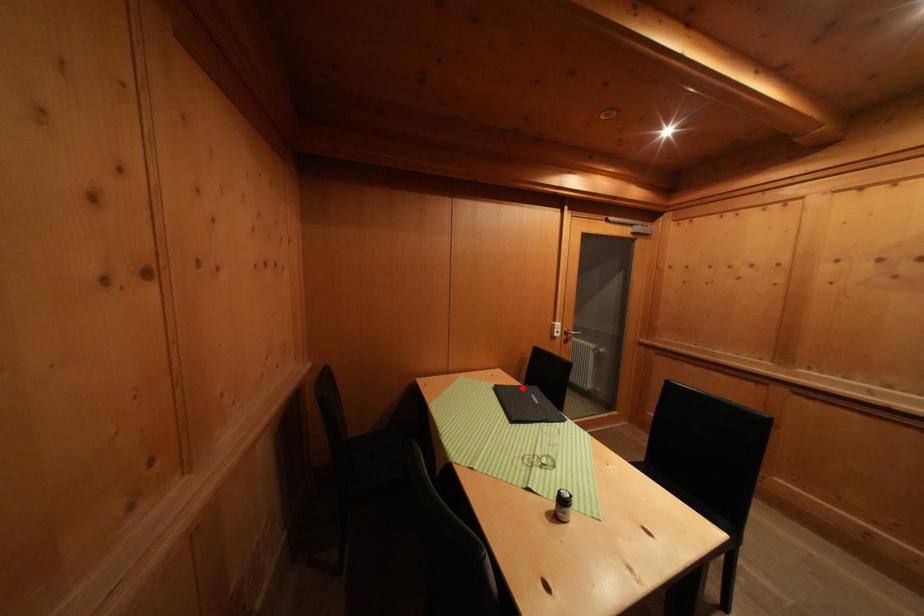
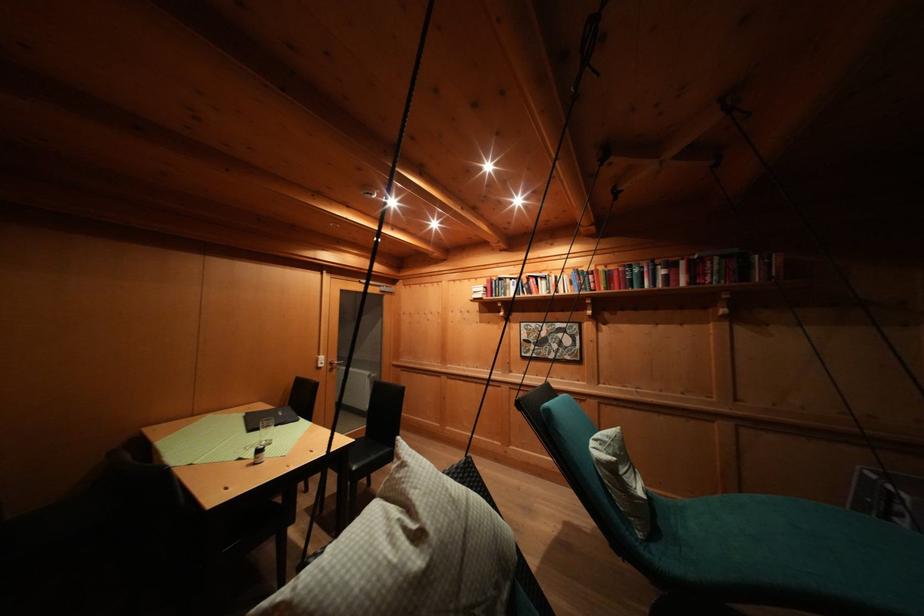
In the second image, find the point that corresponds to the highlighted location in the first image.

(275, 411)